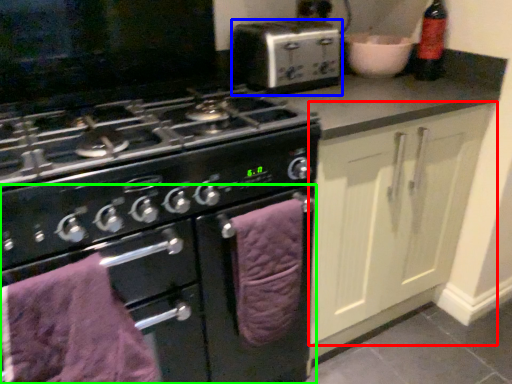
Question: Considering the real-world distances, which object is closest to cabinetry (highlighted by a red box)? kitchen appliance (highlighted by a blue box) or oven (highlighted by a green box).

Choices:
 (A) kitchen appliance
 (B) oven

Answer: (B)